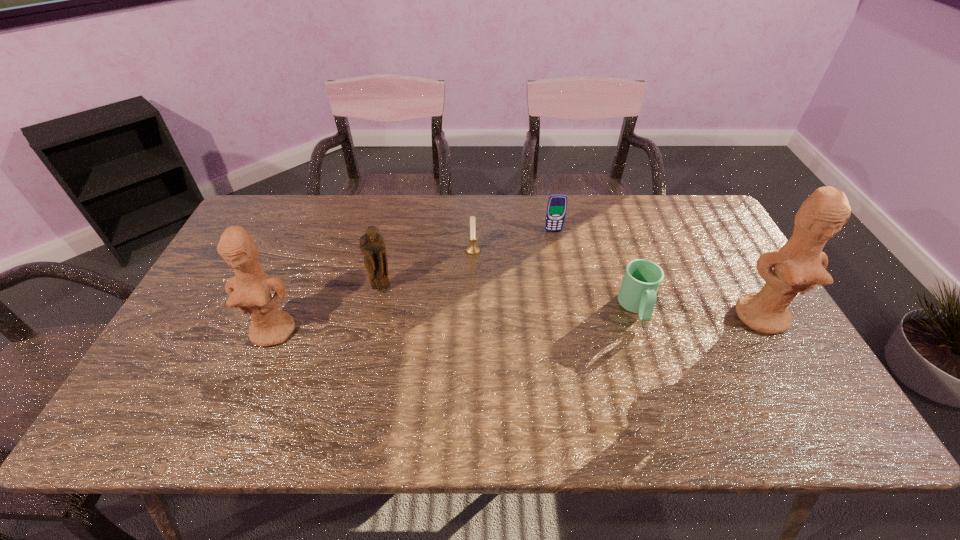
The height and width of the screenshot is (540, 960). In order to click on the fifth shortest object in this screenshot , I will do `click(250, 290)`.

Locate an element on the screen. This screenshot has height=540, width=960. the second tallest figurine is located at coordinates 250,290.

The width and height of the screenshot is (960, 540). I want to click on the tallest object, so 799,265.

Identify the location of the tallest figurine. The height and width of the screenshot is (540, 960). (799, 265).

You are a GUI agent. You are given a task and a screenshot of the screen. Output one action in this format:
    pyautogui.click(x=<x>, y=<y>)
    Task: Click on the candle holder
    
    Given the screenshot: What is the action you would take?
    (x=472, y=249)

Identify the location of the third object from left to right. The height and width of the screenshot is (540, 960). click(x=472, y=249).

Where is `the farthest object`? This screenshot has width=960, height=540. the farthest object is located at coordinates pyautogui.click(x=557, y=203).

Image resolution: width=960 pixels, height=540 pixels. Find the location of `cellular telephone`. cellular telephone is located at coordinates (557, 203).

Locate an element on the screen. mug is located at coordinates (642, 278).

At what (x,y) coordinates should I click in order to perform the action: click on the third tallest object. Please return your answer as a coordinate pair (x, y). Looking at the image, I should click on (372, 245).